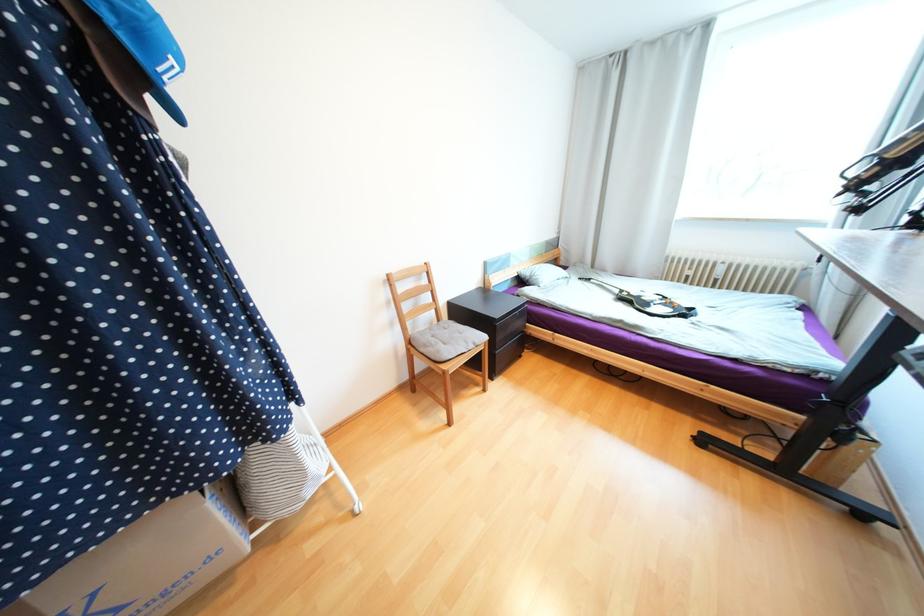
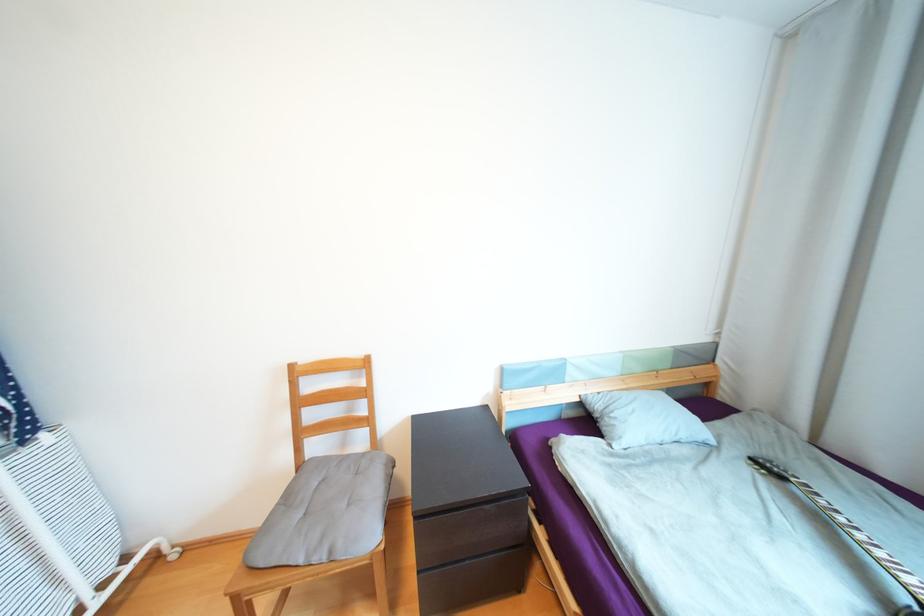
Find the pixel in the second image that matches (480,344) in the first image.

(335, 553)